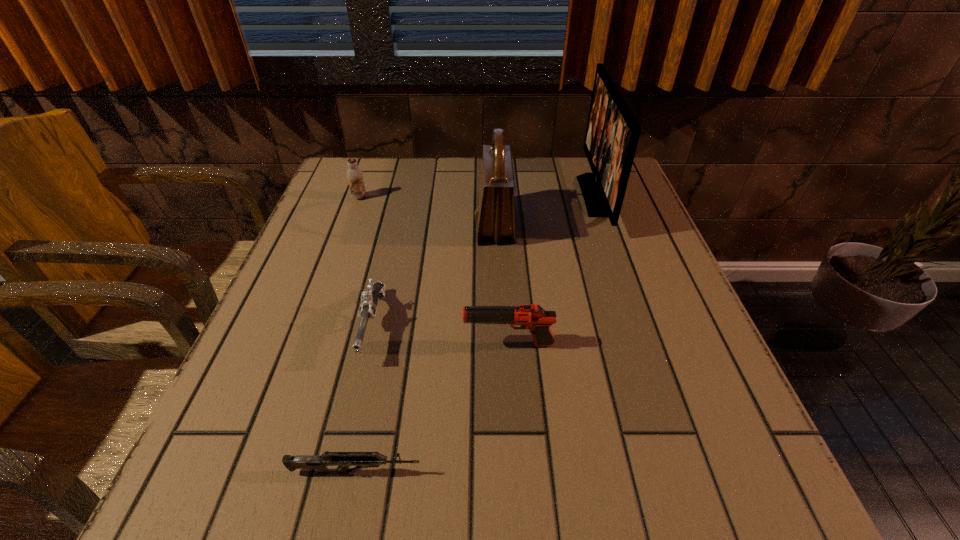
Image resolution: width=960 pixels, height=540 pixels. In order to click on chocolate milk that is positioned at the far edge in this screenshot , I will do `click(354, 175)`.

The width and height of the screenshot is (960, 540). What are the coordinates of `object at the near edge` in the screenshot? It's located at (319, 463).

I want to click on chocolate milk situated at the left edge, so click(x=354, y=175).

Locate an element on the screen. gun that is positioned at the left edge is located at coordinates (319, 463).

Image resolution: width=960 pixels, height=540 pixels. I want to click on object that is at the right edge, so click(x=612, y=133).

The width and height of the screenshot is (960, 540). I want to click on object present at the far left corner, so click(354, 175).

Image resolution: width=960 pixels, height=540 pixels. What are the coordinates of `object that is at the near left corner` in the screenshot? It's located at (319, 463).

Where is `object located in the far right corner section of the desktop`? The width and height of the screenshot is (960, 540). object located in the far right corner section of the desktop is located at coordinates (612, 133).

Identify the location of free location at the far edge of the desktop. The width and height of the screenshot is (960, 540). (416, 201).

Locate an element on the screen. vacant region at the near edge of the desktop is located at coordinates (456, 500).